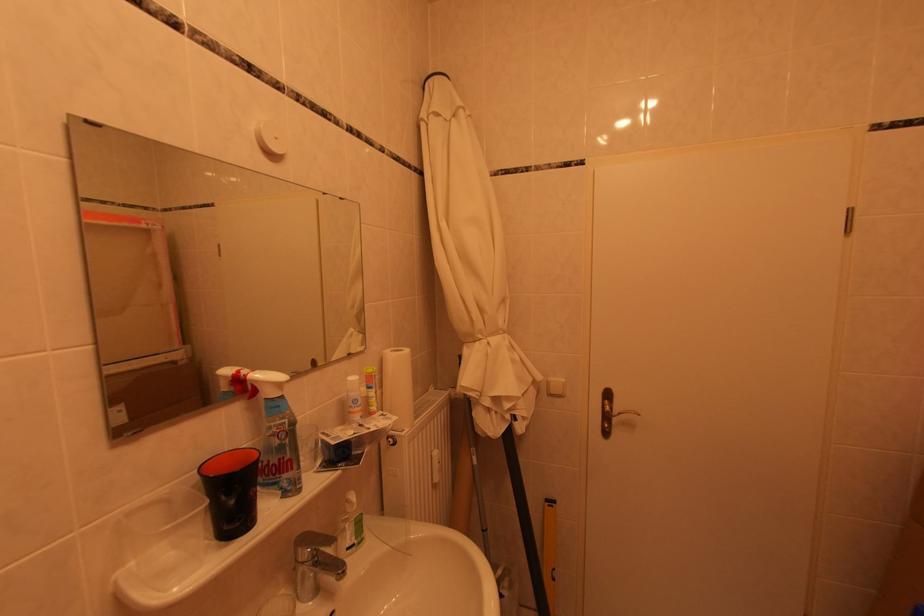
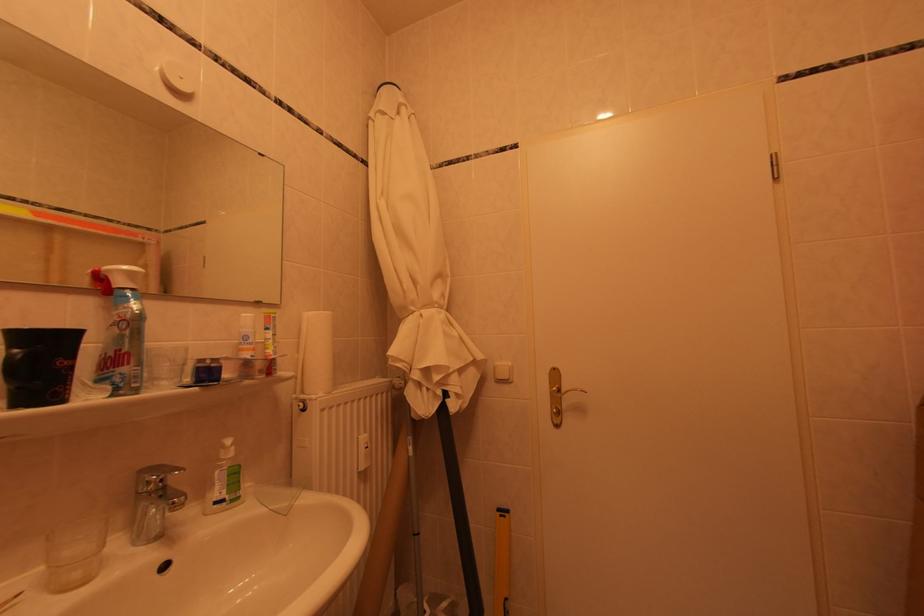
Find the pixel in the second image that matches [557,509] in the first image.

(509, 519)